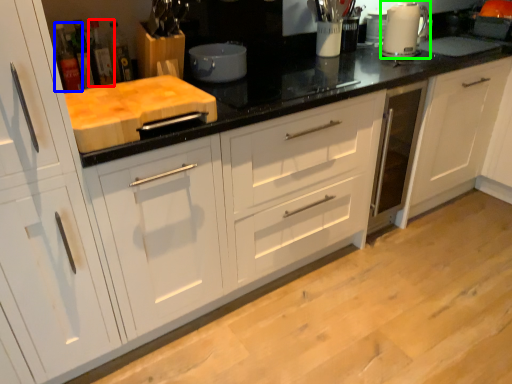
Question: Estimate the real-world distances between objects in this image. Which object is farther from bottle (highlighted by a red box), bottle (highlighted by a blue box) or home appliance (highlighted by a green box)?

Choices:
 (A) bottle
 (B) home appliance

Answer: (B)